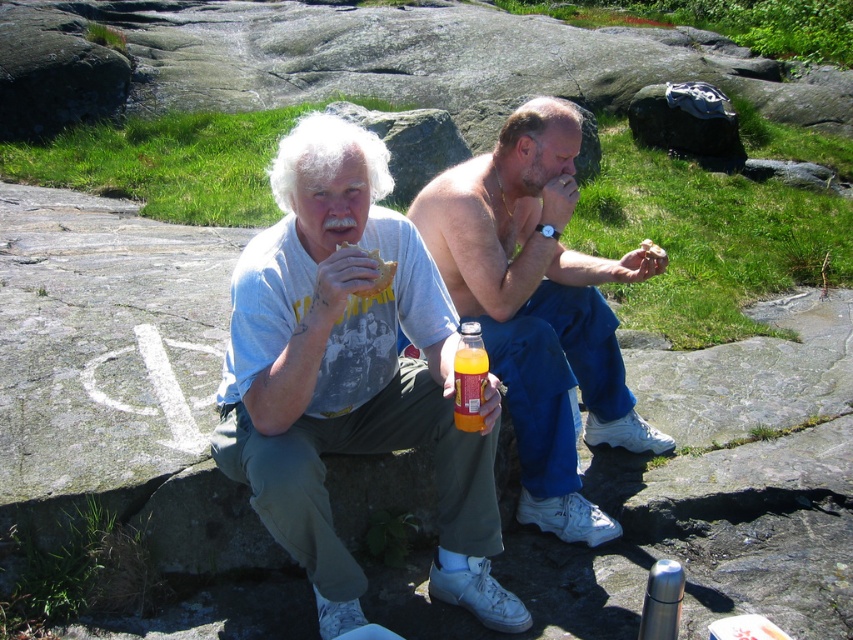
Question: Does orange plastic bottle at center come in front of white soft bread at center?

Choices:
 (A) yes
 (B) no

Answer: (A)

Question: Considering the real-world distances, which object is farthest from the orange plastic bottle at center?

Choices:
 (A) white soft bread at center
 (B) matte bread at center
 (C) shiny orange bottle at center
 (D) matte gray t-shirt at center

Answer: (A)

Question: In this image, where is orange plastic bottle at center located relative to matte bread at center?

Choices:
 (A) below
 (B) above

Answer: (A)

Question: Which point is farther from the camera taking this photo?

Choices:
 (A) (660, 257)
 (B) (461, 301)
 (C) (374, 257)

Answer: (B)

Question: Does matte gray t-shirt at center appear on the right side of white soft bread at center?

Choices:
 (A) yes
 (B) no

Answer: (B)

Question: Which of these objects is positioned farthest from the matte gray t-shirt at center?

Choices:
 (A) white soft bread at center
 (B) shiny orange bottle at center

Answer: (A)